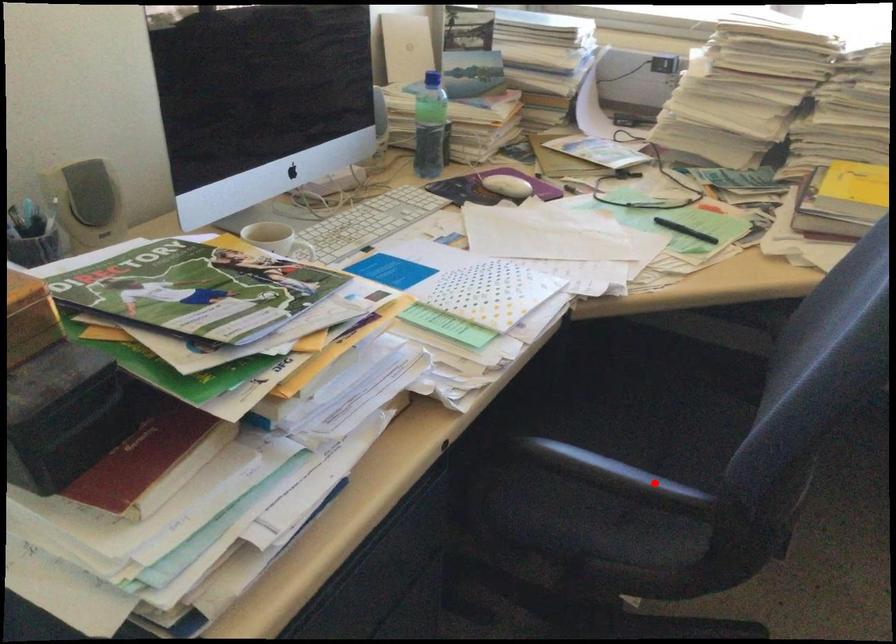
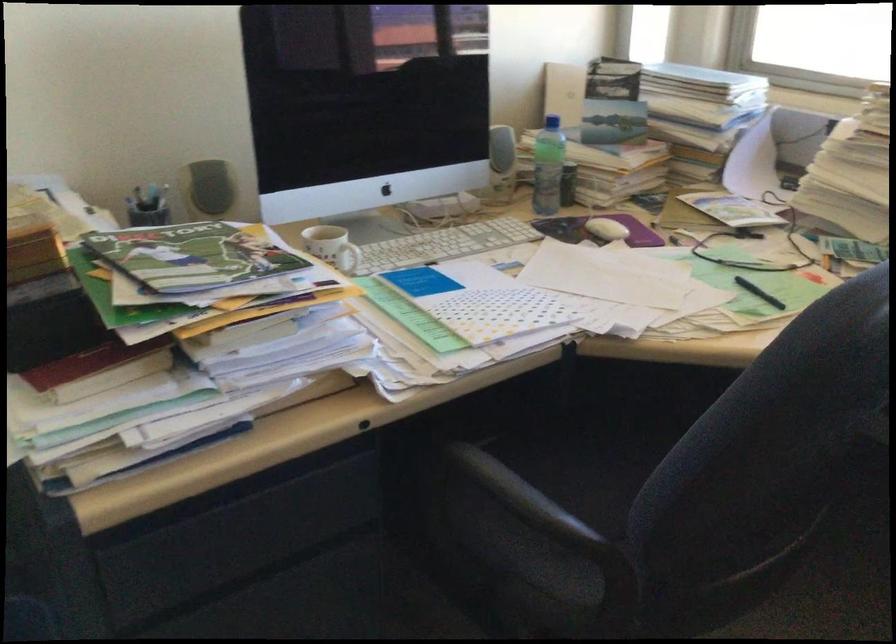
Locate, in the second image, the point that corresponds to the highlighted location in the first image.

(532, 506)